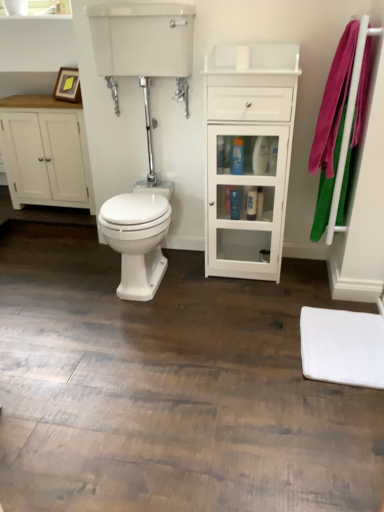
Find the location of `vacant area that lies between white glossy cabinet at center and white matte mat at lower right`. vacant area that lies between white glossy cabinet at center and white matte mat at lower right is located at coordinates (273, 303).